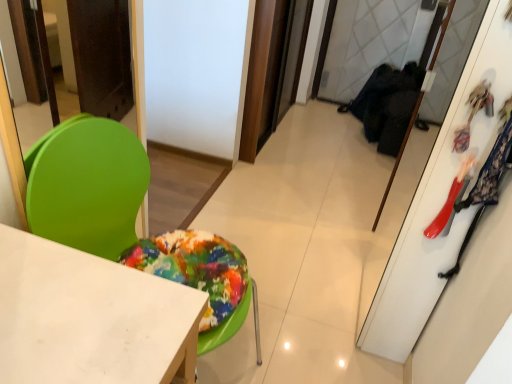
Question: Should I look upward or downward to see green plastic chair at left?

Choices:
 (A) down
 (B) up

Answer: (B)